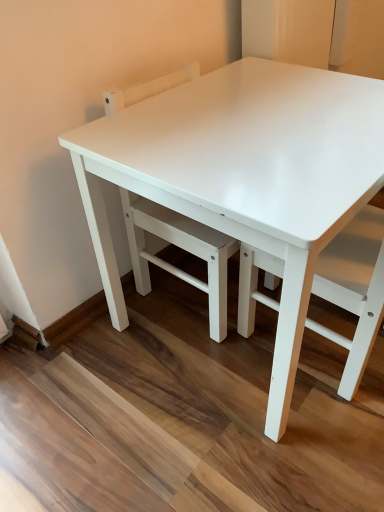
Question: In the image, is white glossy table top at center on the left side or the right side of white matte chair at center?

Choices:
 (A) right
 (B) left

Answer: (B)

Question: From a real-world perspective, is white glossy table top at center above or below white matte chair at center?

Choices:
 (A) below
 (B) above

Answer: (B)

Question: Which object is the farthest from the white matte chair at center?

Choices:
 (A) white glossy table top at center
 (B) white glossy table at center

Answer: (A)

Question: Which object is the closest to the white glossy table top at center?

Choices:
 (A) white matte chair at center
 (B) white glossy table at center

Answer: (B)